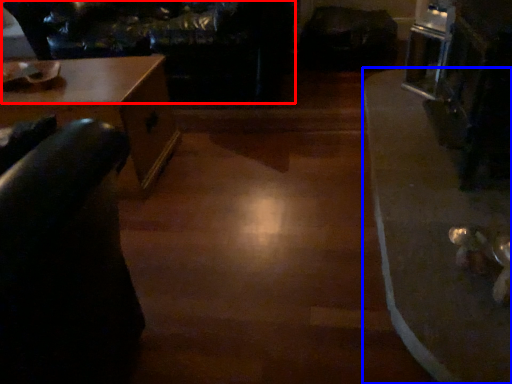
Question: Which of the following is the farthest to the observer, couch (highlighted by a red box) or table (highlighted by a blue box)?

Choices:
 (A) couch
 (B) table

Answer: (A)